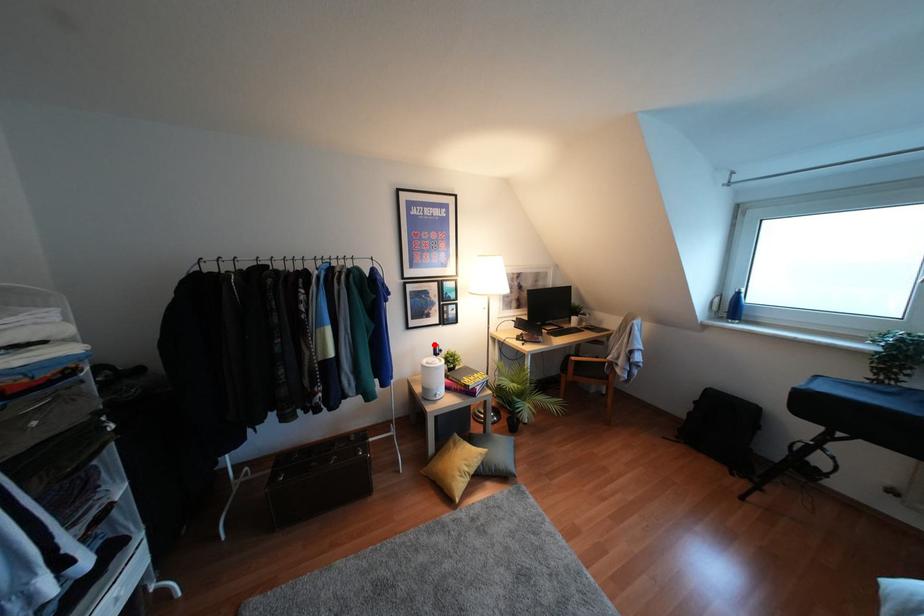
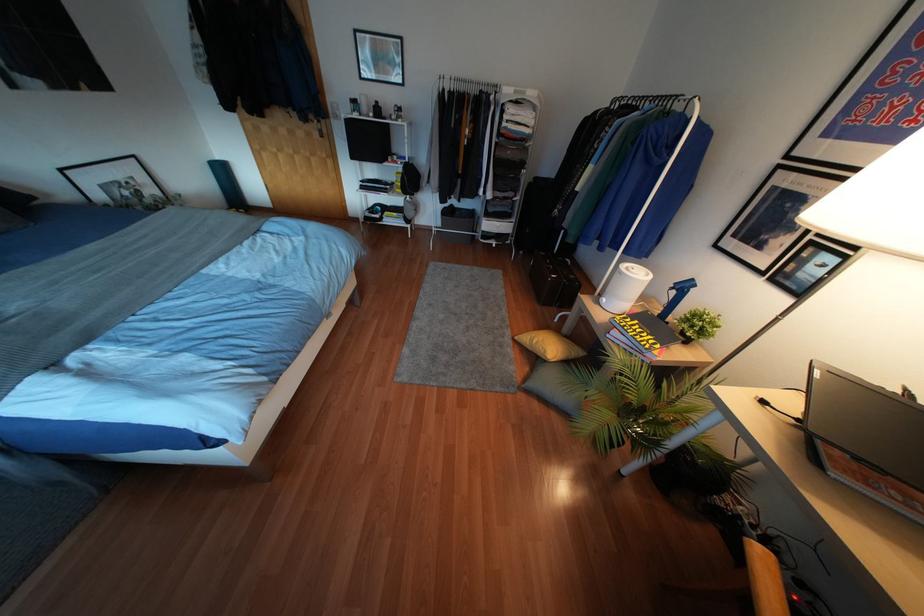
Where in the second image is the point corresponding to the highlighted location from the first image?

(690, 280)